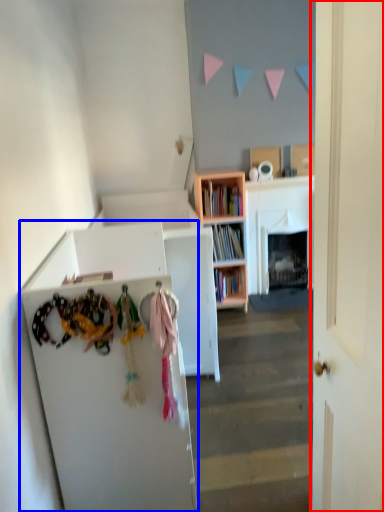
Question: Which object appears farthest to the camera in this image, door (highlighted by a red box) or cabinetry (highlighted by a blue box)?

Choices:
 (A) door
 (B) cabinetry

Answer: (B)